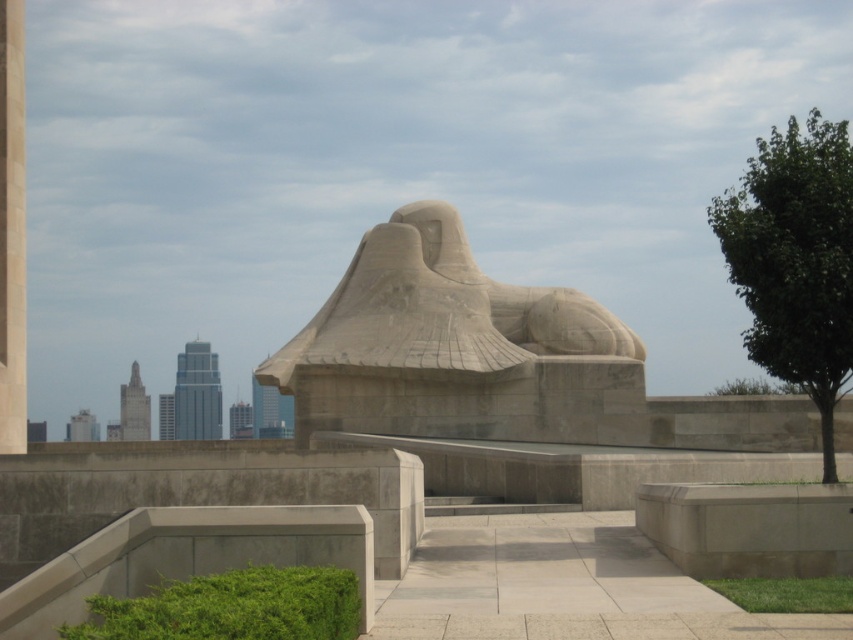
Question: Which point appears closest to the camera in this image?

Choices:
 (A) (828, 468)
 (B) (271, 376)
 (C) (9, 381)

Answer: (A)

Question: Which object is positioned farthest from the smooth stone sculpture at center?

Choices:
 (A) smooth concrete pillar at left
 (B) green leafy tree at right

Answer: (B)

Question: Which point appears farthest from the camera in this image?

Choices:
 (A) (567, 304)
 (B) (746, 186)

Answer: (A)

Question: Does smooth stone sculpture at center come in front of green leafy tree at right?

Choices:
 (A) yes
 (B) no

Answer: (B)

Question: Is smooth stone sculpture at center thinner than smooth concrete pillar at left?

Choices:
 (A) yes
 (B) no

Answer: (B)

Question: Does smooth stone sculpture at center appear on the right side of green leafy tree at right?

Choices:
 (A) yes
 (B) no

Answer: (B)